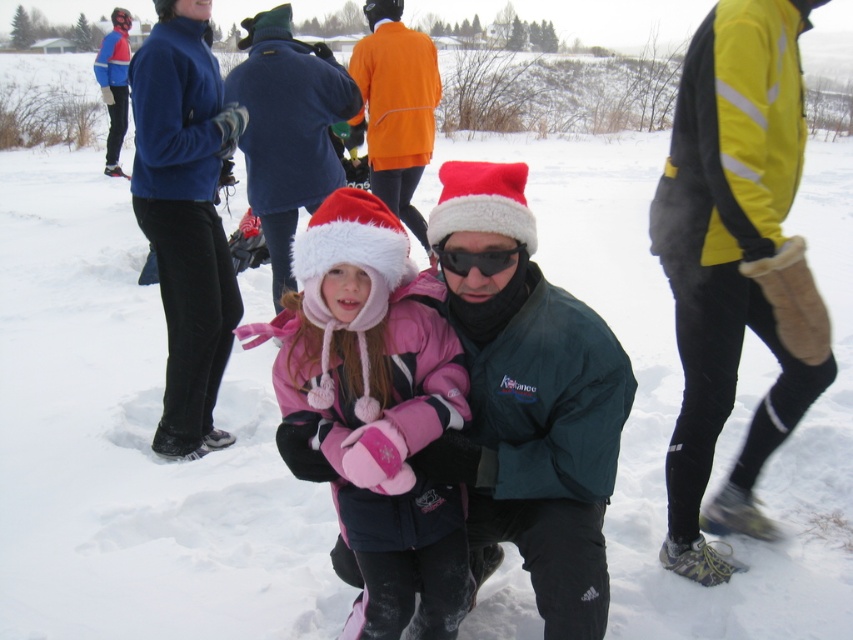
Question: Is green matte jacket at center to the left of pink fleece jacket at center from the viewer's perspective?

Choices:
 (A) yes
 (B) no

Answer: (B)

Question: Which object is farther from the camera taking this photo?

Choices:
 (A) yellow reflective jacket at right
 (B) black reflective goggles at center

Answer: (A)

Question: Can you confirm if yellow reflective jacket at right is bigger than pink fleece jacket at center?

Choices:
 (A) no
 (B) yes

Answer: (B)

Question: Among these points, which one is nearest to the camera?

Choices:
 (A) (445, 262)
 (B) (694, 500)
 (C) (546, 360)

Answer: (A)

Question: Which of the following is the farthest from the observer?

Choices:
 (A) black reflective goggles at center
 (B) green matte jacket at center
 (C) yellow reflective jacket at right

Answer: (C)

Question: Does pink fleece jacket at center have a greater width compared to blue fleece jacket at upper left?

Choices:
 (A) yes
 (B) no

Answer: (A)